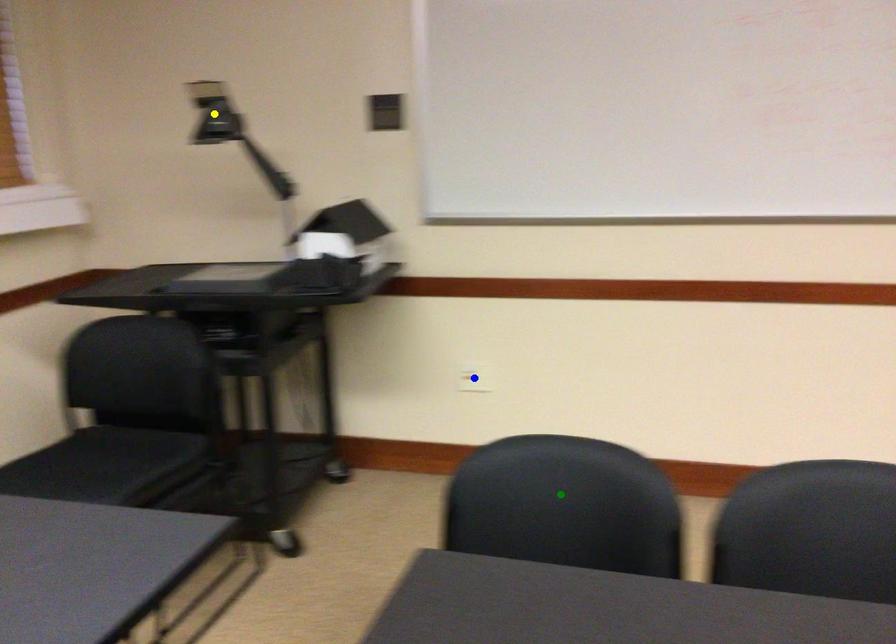
Order these from nearest to farthest:
blue point | yellow point | green point

1. blue point
2. yellow point
3. green point